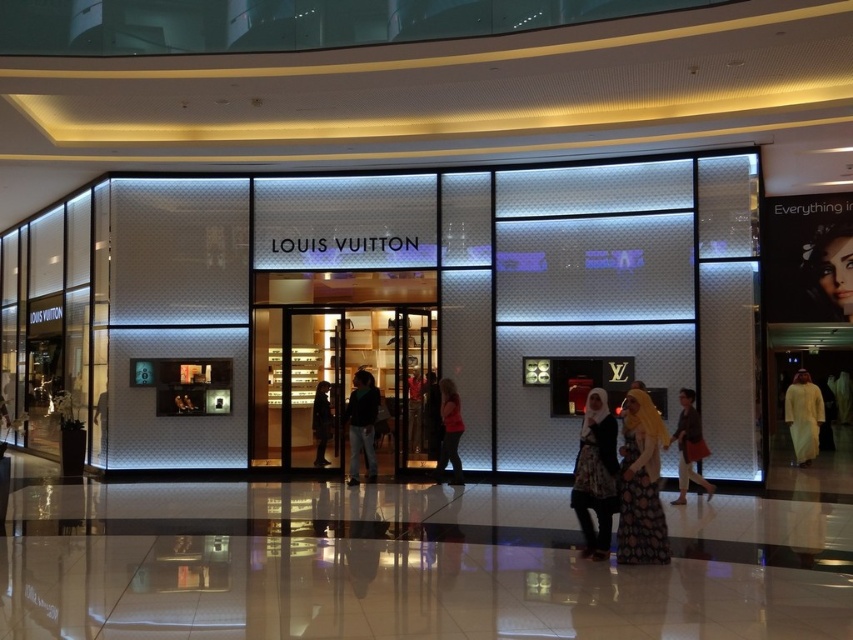
You are a customer standing at the entrance of the Louis Vuitton store. You see a printed fabric dress at center and a smooth skin face at upper right. Which object is closer to the entrance?

The printed fabric dress at center is closer to the entrance because it is located below the smooth skin face at upper right, meaning it is positioned lower in the image and thus nearer to the entrance area.

You are standing at the entrance of the Louis Vuitton store and want to take a photo of the point at coordinates (787, 387). If your camera has a maximum zoom range of 20 meters, will you be able to capture the point clearly in your photo?

The point at coordinates (787, 387) is 23.54 meters away from the camera, which exceeds the camera maximum zoom range of 20 meters. Therefore, the camera cannot capture the point clearly.